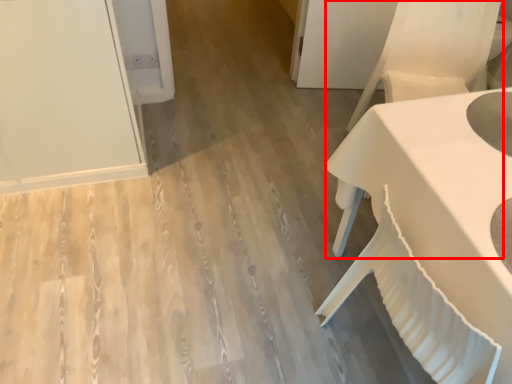
Question: From the image's perspective, what is the correct spatial relationship of armchair (annotated by the red box) in relation to table?

Choices:
 (A) below
 (B) above

Answer: (B)